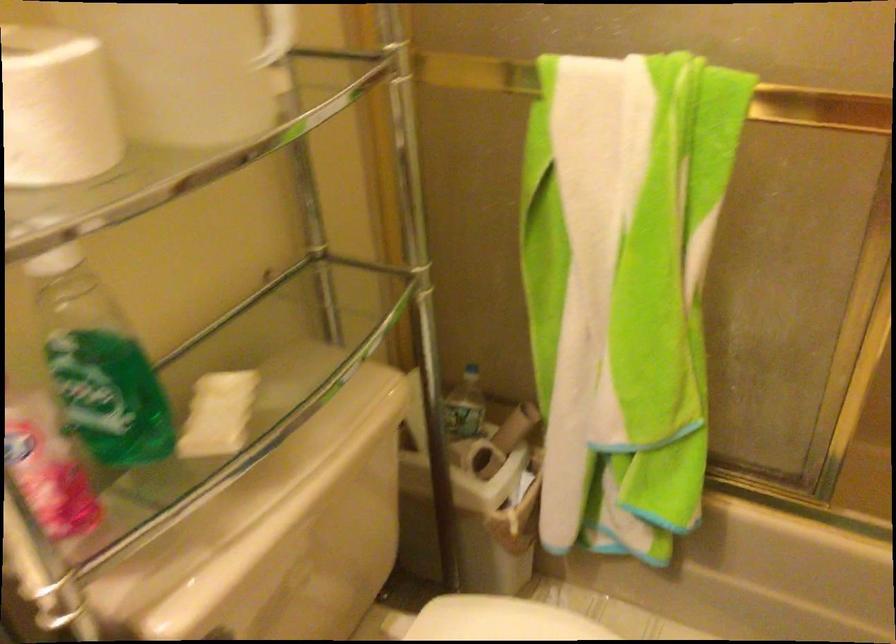
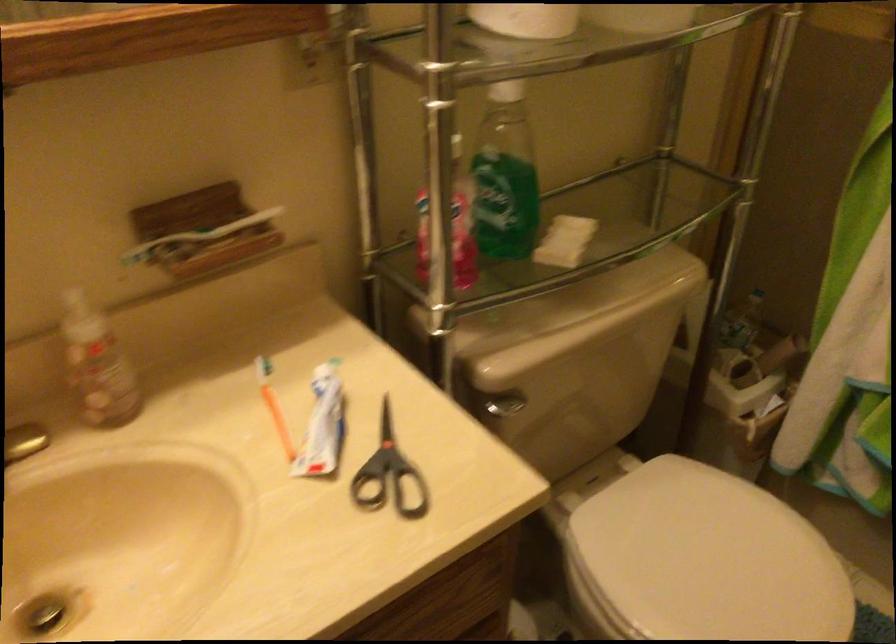
Where in the second image is the point corresponding to (x=99, y=366) from the first image?

(504, 176)